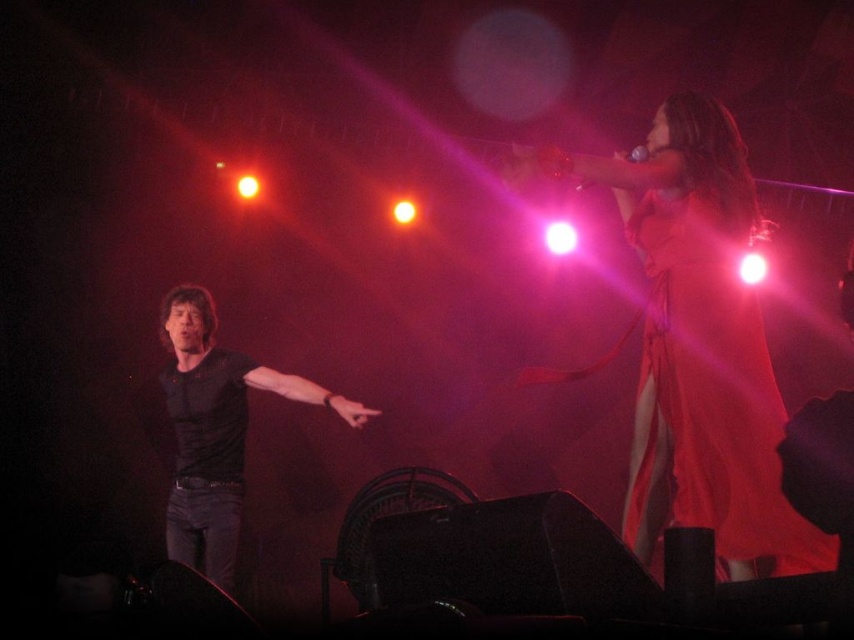
The height and width of the screenshot is (640, 854). What do you see at coordinates (706, 400) in the screenshot?
I see `silky red dress at upper right` at bounding box center [706, 400].

Is silky red dress at upper right positioned in front of black matte shirt at left?

Yes.

Between point (730, 296) and point (214, 518), which one is positioned in front?

Point (730, 296) is more forward.

At what (x,y) coordinates should I click in order to perform the action: click on silky red dress at upper right. Please return your answer as a coordinate pair (x, y). Looking at the image, I should click on (706, 400).